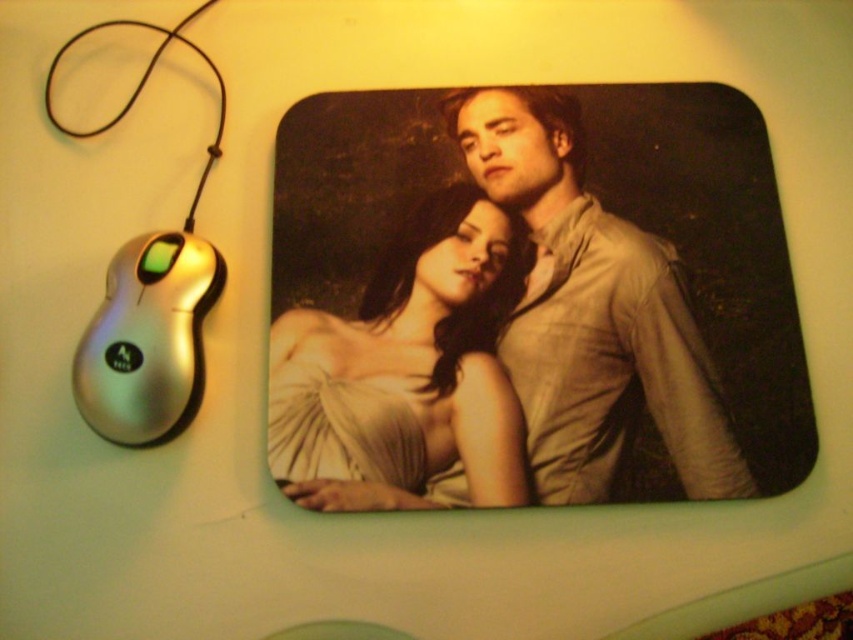
The width and height of the screenshot is (853, 640). In order to click on matte beige shirt at center in this screenshot , I will do `click(590, 310)`.

The height and width of the screenshot is (640, 853). I want to click on matte beige shirt at center, so click(590, 310).

Can you confirm if matte beige shirt at center is taller than silver metallic mouse at left?

Indeed, matte beige shirt at center has a greater height compared to silver metallic mouse at left.

Is point (672, 392) in front of point (149, 323)?

No, (672, 392) is behind (149, 323).

At what (x,y) coordinates should I click in order to perform the action: click on matte beige shirt at center. Please return your answer as a coordinate pair (x, y). This screenshot has height=640, width=853. Looking at the image, I should click on (590, 310).

Does matte white dress at center appear under silver metallic mouse at left?

Indeed, matte white dress at center is positioned under silver metallic mouse at left.

At what (x,y) coordinates should I click in order to perform the action: click on matte white dress at center. Please return your answer as a coordinate pair (x, y). Looking at the image, I should click on (405, 371).

You are a GUI agent. You are given a task and a screenshot of the screen. Output one action in this format:
    pyautogui.click(x=<x>, y=<y>)
    Task: Click on the matte white dress at center
    
    Given the screenshot: What is the action you would take?
    pyautogui.click(x=405, y=371)